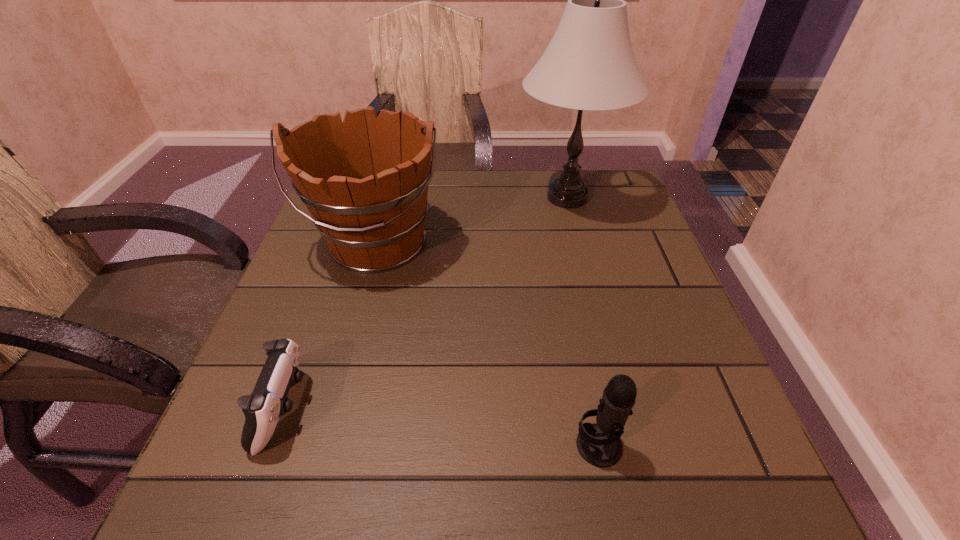
You are a GUI agent. You are given a task and a screenshot of the screen. Output one action in this format:
    pyautogui.click(x=<x>, y=<y>)
    Task: Click on the vacant area at the left edge of the desktop
    
    Given the screenshot: What is the action you would take?
    pyautogui.click(x=248, y=380)

In the image, there is a desktop. Identify the location of free space at the right edge. This screenshot has width=960, height=540. (619, 321).

Image resolution: width=960 pixels, height=540 pixels. In the image, there is a desktop. What are the coordinates of `free region at the near left corner` in the screenshot? It's located at (261, 462).

Identify the location of vacant area at the far right corner of the desktop. (613, 216).

Where is `free spot between the shortest object and the tallest object`? free spot between the shortest object and the tallest object is located at coordinates (426, 303).

In order to click on free space between the wine bucket and the control in this screenshot , I will do `click(330, 326)`.

Locate an element on the screen. unoccupied position between the second tallest object and the lamp is located at coordinates (472, 220).

Locate an element on the screen. Image resolution: width=960 pixels, height=540 pixels. free space between the third tallest object and the wine bucket is located at coordinates (487, 345).

Identify the location of vacant point located between the shortest object and the microphone. Image resolution: width=960 pixels, height=540 pixels. (442, 427).

At what (x,y) coordinates should I click in order to perform the action: click on free area in between the microphone and the tallest object. Please return your answer as a coordinate pair (x, y). Looking at the image, I should click on (583, 321).